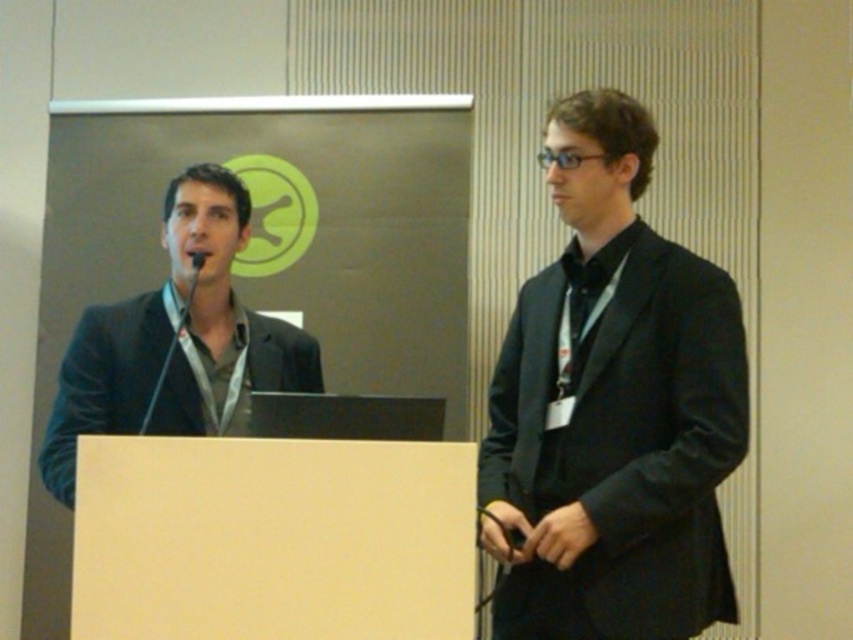
Identify the location of black matte suit at center. Image resolution: width=853 pixels, height=640 pixels. (613, 406).

Does black matte suit at center lie behind matte black suit at left?

No, black matte suit at center is closer to the viewer.

Which is behind, point (651, 468) or point (267, 388)?

Positioned behind is point (267, 388).

Locate an element on the screen. black matte suit at center is located at coordinates (613, 406).